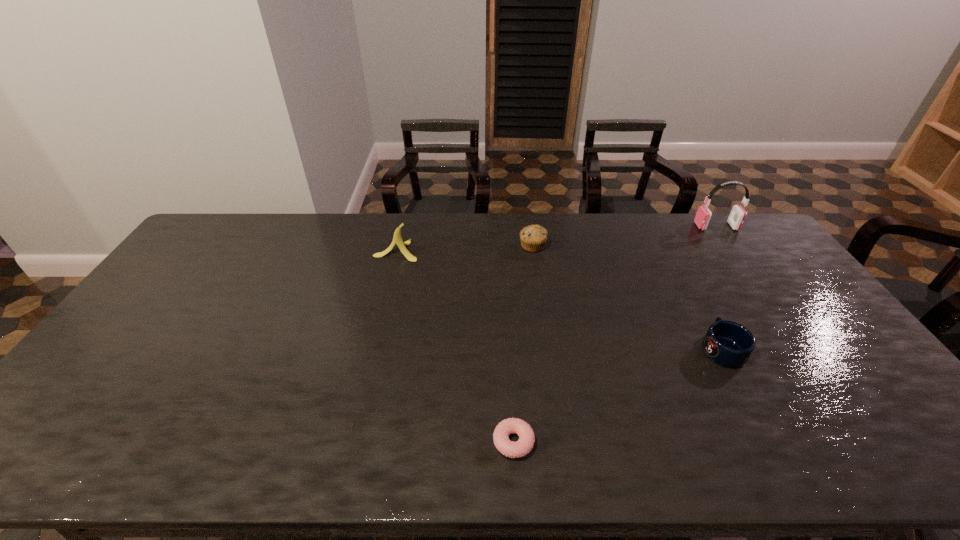
Identify the location of free space between the tallest object and the muffin. (624, 236).

Find the location of `vacant area that lies between the mug and the farthest object`. vacant area that lies between the mug and the farthest object is located at coordinates (719, 287).

You are a GUI agent. You are given a task and a screenshot of the screen. Output one action in this format:
    pyautogui.click(x=<x>, y=<y>)
    Task: Click on the unoccupied position between the farthest object and the doughnut
    This screenshot has height=540, width=960.
    Given the screenshot: What is the action you would take?
    pyautogui.click(x=615, y=334)

Find the location of a particular element. The width and height of the screenshot is (960, 540). vacant area between the muffin and the doughnut is located at coordinates (523, 343).

Locate an element on the screen. Image resolution: width=960 pixels, height=540 pixels. vacant area between the leftmost object and the muffin is located at coordinates (465, 248).

Where is `vacant space that's between the shortest object and the muffin`? Image resolution: width=960 pixels, height=540 pixels. vacant space that's between the shortest object and the muffin is located at coordinates (523, 343).

Identify the location of free space between the second shortest object and the second object from left to right. The image size is (960, 540). (618, 395).

In order to click on free space between the shortest object and the muffin in this screenshot , I will do `click(523, 343)`.

Find the location of `object that is the third closest to the shortest object`. object that is the third closest to the shortest object is located at coordinates (397, 239).

Identify the location of object that can be found as the third closest to the leftmost object. The width and height of the screenshot is (960, 540). (727, 343).